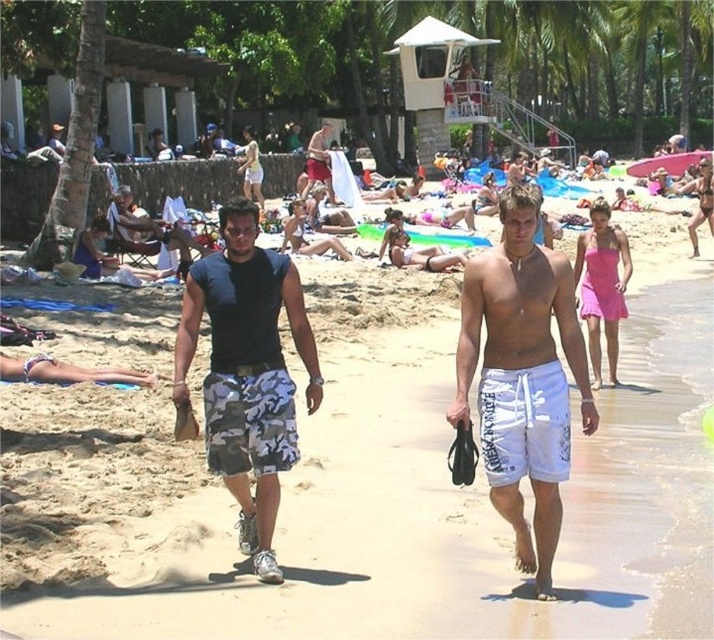
You are a photographer trying to capture a clear shot of the camo fabric shorts at center and the camouflage shorts at center. Which one is closer to the camera?

The camo fabric shorts at center is in front of the camouflage shorts at center, so it is closer to the camera.

You are a photographer trying to capture a candid shot of the two people at the beach. You notice the white cotton shorts at center and the camouflage shorts at center. Which pair of shorts would you focus on if you want to photograph the smaller one?

The white cotton shorts at center is smaller than the camouflage shorts at center, so you should focus on the white cotton shorts at center to capture the smaller one.